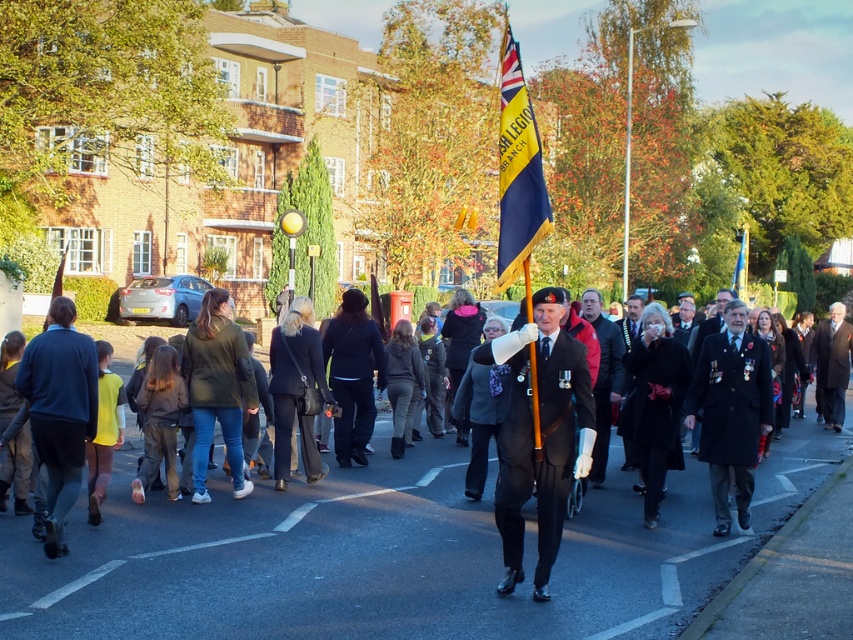
You are a photographer at the event and want to ensure both the black velvet coat at center and the blue fabric flag at center are clearly visible in your photo. Given their sizes, which object should you focus on first to ensure proper framing?

The black velvet coat at center is smaller in size compared to the blue fabric flag at center, so you should focus on the blue fabric flag at center first to ensure it is properly framed, as it takes up more space in the composition.

You are a photographer positioned at the edge of the gathering. You need to capture a photo that includes both the dark brown leather coat at center and the black velvet coat at center. Given that your camera has a maximum focus range of 10 meters, will you be able to fit both subjects within the frame?

The distance between the dark brown leather coat at center and the black velvet coat at center is 9.21 meters, which is within the camera maximum focus range of 10 meters. Therefore, you can fit both subjects within the frame.

You are a photographer at the event and want to capture a photo where both the black velvet coat at center and the blue fabric flag at center are clearly visible. Based on their positions, which object should you focus on first to ensure both are in frame?

The black velvet coat at center is positioned under the blue fabric flag at center, so focusing on the blue fabric flag at center first would allow the camera to capture both objects in the frame since the coat is beneath the flag.